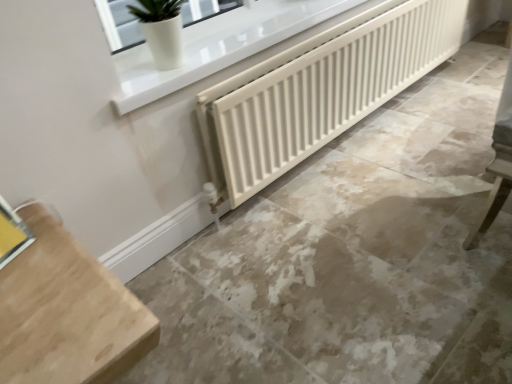
Image resolution: width=512 pixels, height=384 pixels. In order to click on free spot above light wood table at lower left (from a real-world perspective) in this screenshot , I will do `click(34, 297)`.